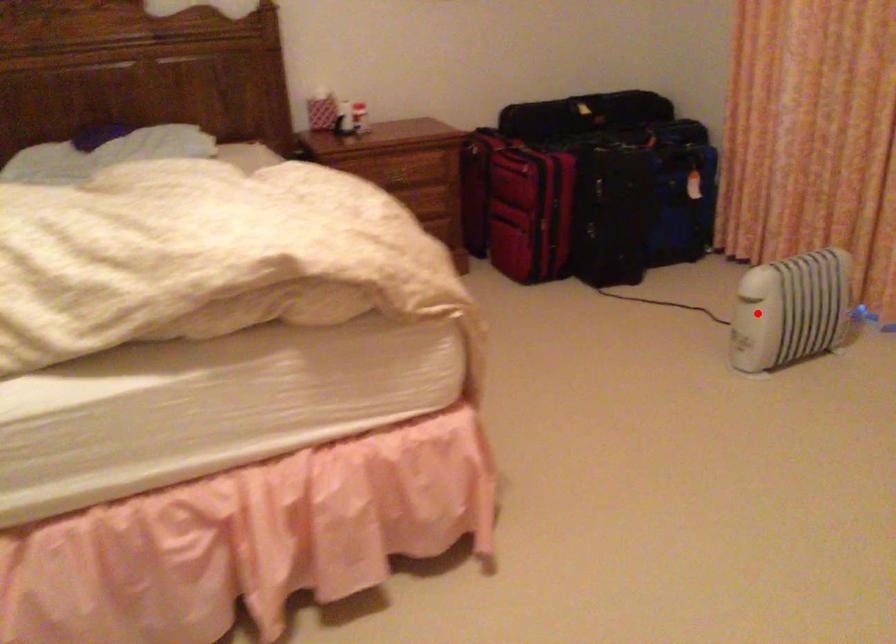
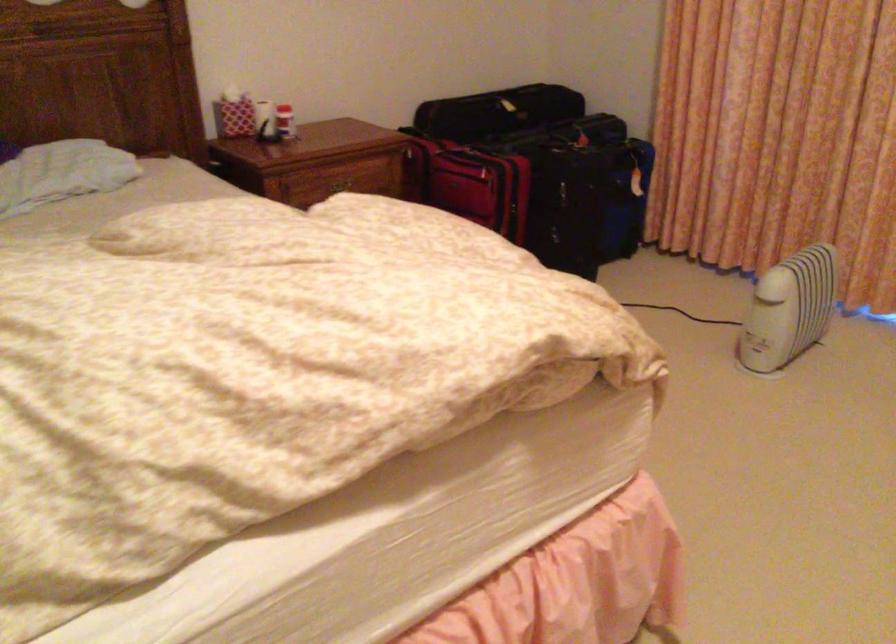
The point at the highlighted location is marked in the first image. Where is the corresponding point in the second image?

(789, 308)